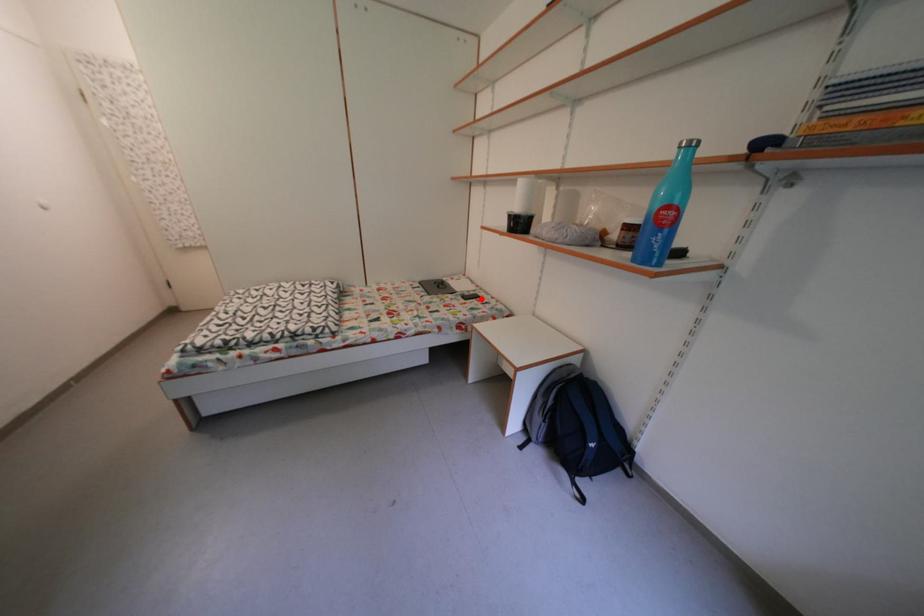
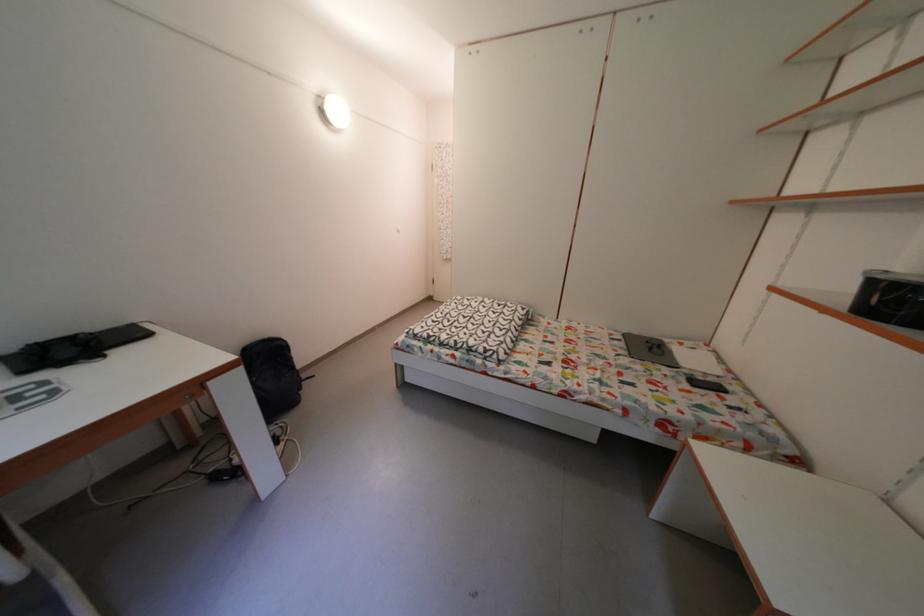
In the second image, find the point that corresponds to the highlighted location in the first image.

(721, 385)